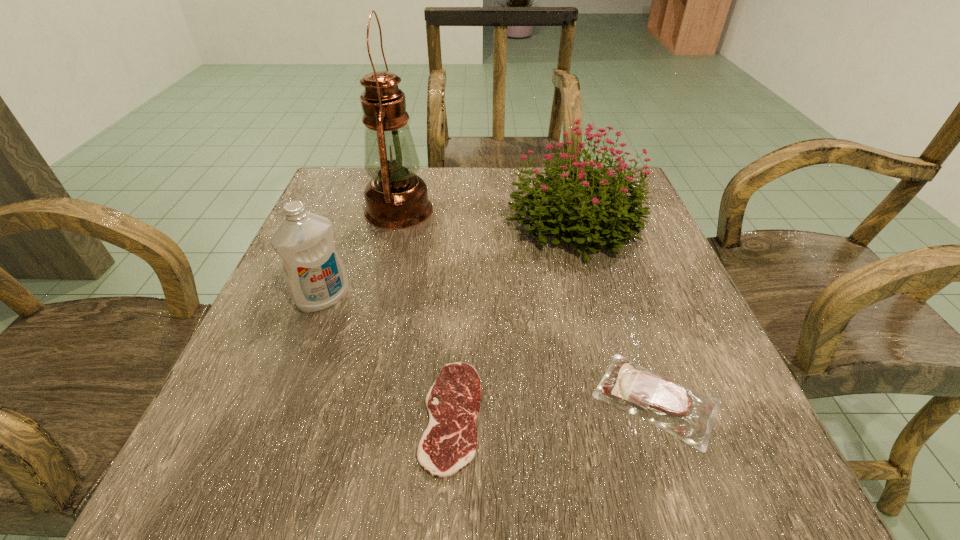
This screenshot has height=540, width=960. I want to click on free space that satisfies the following two spatial constraints: 1. on the back side of the oil lamp; 2. on the left side of the detergent, so [x=356, y=210].

Where is `blank area in the image that satisfies the following two spatial constraints: 1. on the front side of the fourth tallest object; 2. on the left side of the bouquet`? This screenshot has width=960, height=540. blank area in the image that satisfies the following two spatial constraints: 1. on the front side of the fourth tallest object; 2. on the left side of the bouquet is located at coordinates (622, 399).

This screenshot has width=960, height=540. Find the location of `vacant space that satisfies the following two spatial constraints: 1. on the back side of the right steak; 2. on the left side of the third object from right to left`. vacant space that satisfies the following two spatial constraints: 1. on the back side of the right steak; 2. on the left side of the third object from right to left is located at coordinates pyautogui.click(x=452, y=399).

You are a GUI agent. You are given a task and a screenshot of the screen. Output one action in this format:
    pyautogui.click(x=<x>, y=<y>)
    Task: Click on the free point that satisfies the following two spatial constraints: 1. on the back side of the detergent; 2. on the right side of the bouquet
    The width and height of the screenshot is (960, 540).
    Given the screenshot: What is the action you would take?
    [352, 222]

Identify the location of blank space that satisfies the following two spatial constraints: 1. on the front side of the fourth tallest object; 2. on the right side of the bouquet. This screenshot has height=540, width=960. (622, 399).